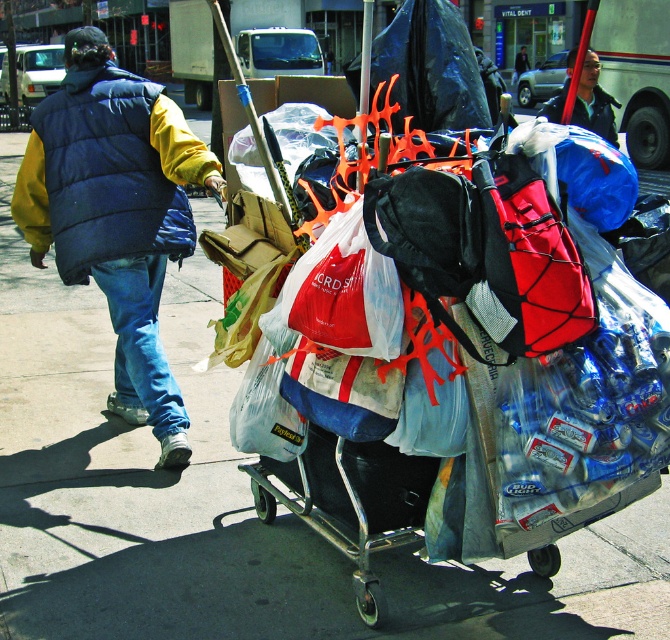
Looking at this image, is blue puffy vest at left taller than blue puffy vest at upper left?

Yes.

Between point (129, 288) and point (113, 132), which one is positioned in front?

Point (113, 132)

This screenshot has height=640, width=670. Identify the location of blue puffy vest at left. (117, 214).

Locate an element on the screen. blue puffy vest at left is located at coordinates (117, 214).

Does point (159, 122) come in front of point (612, 122)?

Yes, it is in front of point (612, 122).

Locate an element on the screen. The height and width of the screenshot is (640, 670). blue puffy vest at upper left is located at coordinates (107, 172).

Can you confirm if blue puffy vest at left is shorter than dark blue jacket at center?

Yes, blue puffy vest at left is shorter than dark blue jacket at center.

Identify the location of blue puffy vest at left. The image size is (670, 640). (117, 214).

Which is behind, point (107, 104) or point (604, 115)?

The point (604, 115) is more distant.

Identify the location of blue puffy vest at left. The width and height of the screenshot is (670, 640). (117, 214).